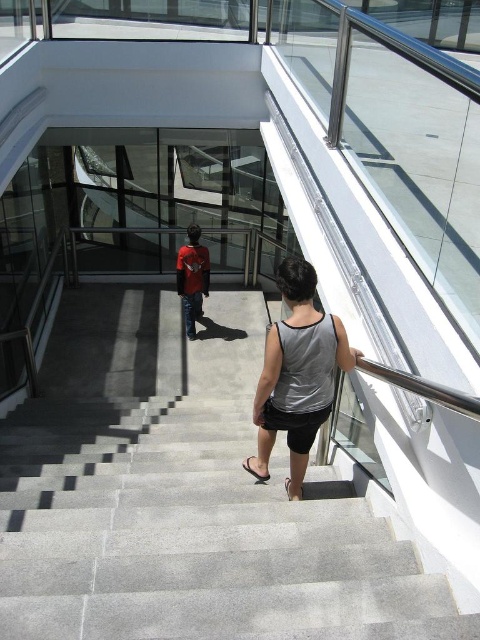
Question: In this image, where is gray concrete stairs at center located relative to gray fabric tank top at center?

Choices:
 (A) right
 (B) left

Answer: (B)

Question: Is gray concrete stairs at center behind red shirt at center?

Choices:
 (A) no
 (B) yes

Answer: (A)

Question: Which object is positioned closest to the gray fabric tank top at center?

Choices:
 (A) red shirt at center
 (B) gray concrete stairs at center

Answer: (B)

Question: Is gray fabric tank top at center above red shirt at center?

Choices:
 (A) no
 (B) yes

Answer: (A)

Question: Estimate the real-world distances between objects in this image. Which object is farther from the red shirt at center?

Choices:
 (A) gray fabric tank top at center
 (B) gray concrete stairs at center

Answer: (B)

Question: Which object is the farthest from the gray fabric tank top at center?

Choices:
 (A) gray concrete stairs at center
 (B) red shirt at center

Answer: (B)